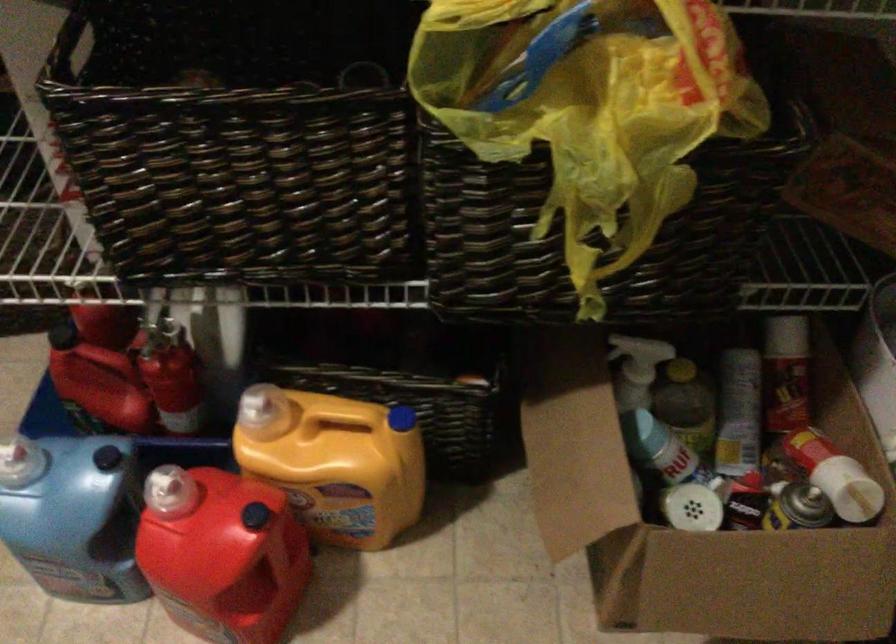
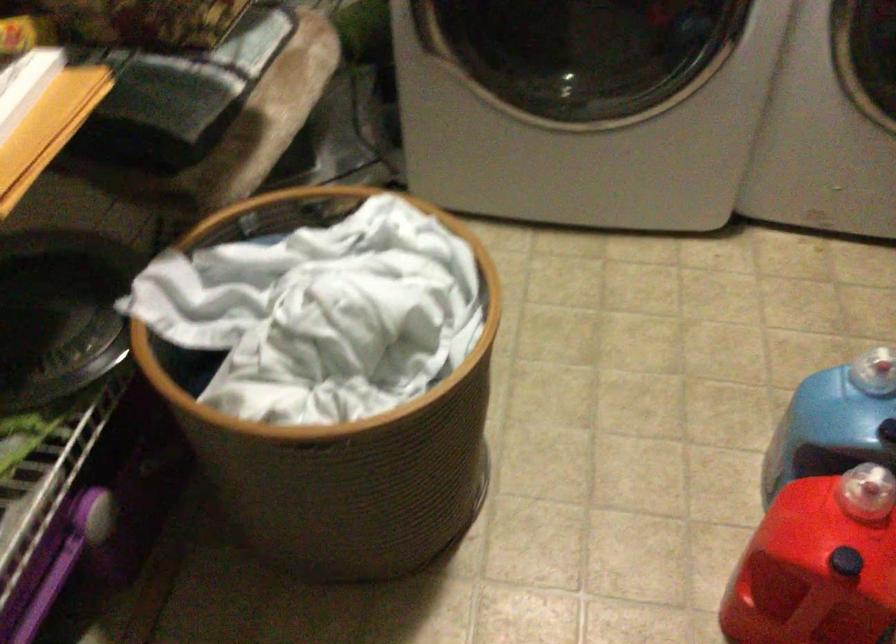
In the second image, find the point that corresponds to (164,486) in the first image.

(866, 491)